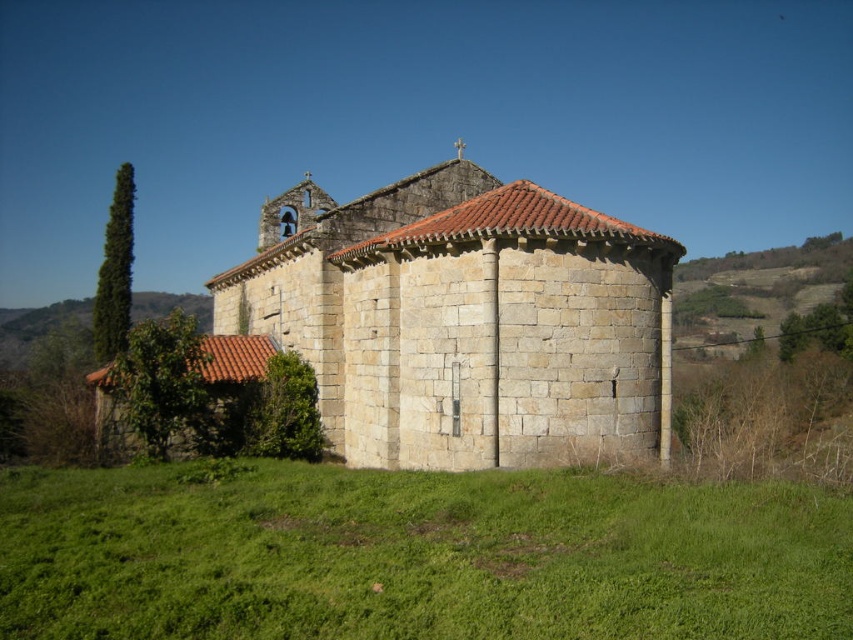
Question: Does green grass at lower center lie behind stone textured chapel at center?

Choices:
 (A) no
 (B) yes

Answer: (A)

Question: Can you confirm if green grass at lower center is positioned above stone textured chapel at center?

Choices:
 (A) no
 (B) yes

Answer: (A)

Question: Is green grass at lower center to the right of stone textured chapel at center from the viewer's perspective?

Choices:
 (A) yes
 (B) no

Answer: (A)